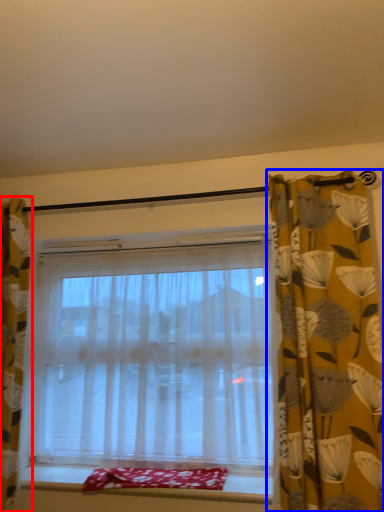
Question: Which object appears farthest to the camera in this image, curtain (highlighted by a red box) or curtain (highlighted by a blue box)?

Choices:
 (A) curtain
 (B) curtain

Answer: (A)